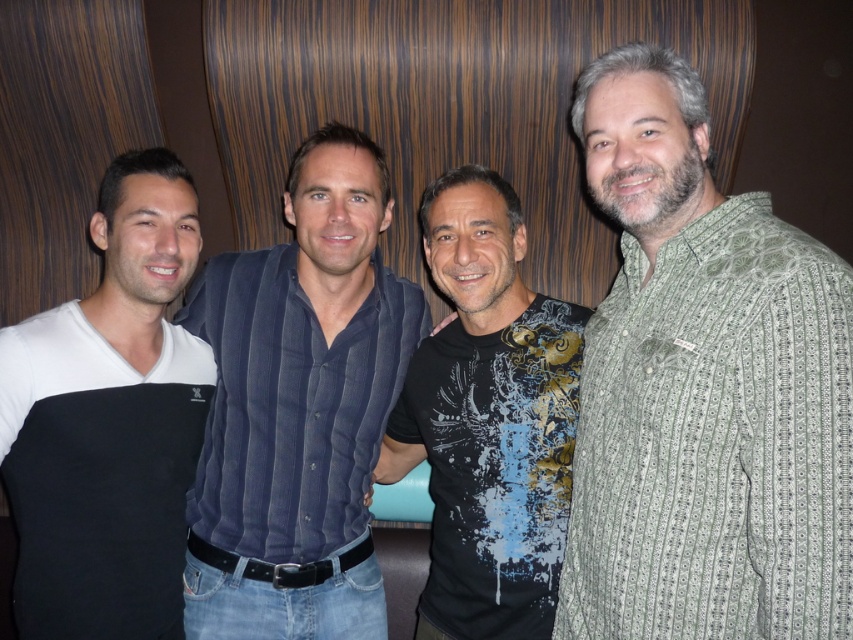
You are standing in front of the group of men described in the scene. Which man is wearing the green striped shirt at right?

The green striped shirt at right is located at point (703, 388), so the man wearing it is the one positioned at that coordinate.